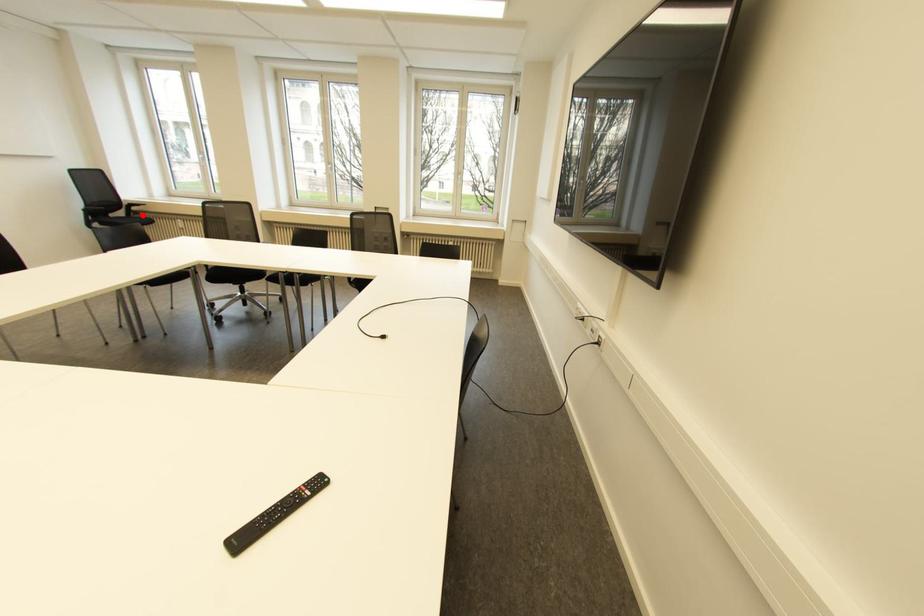
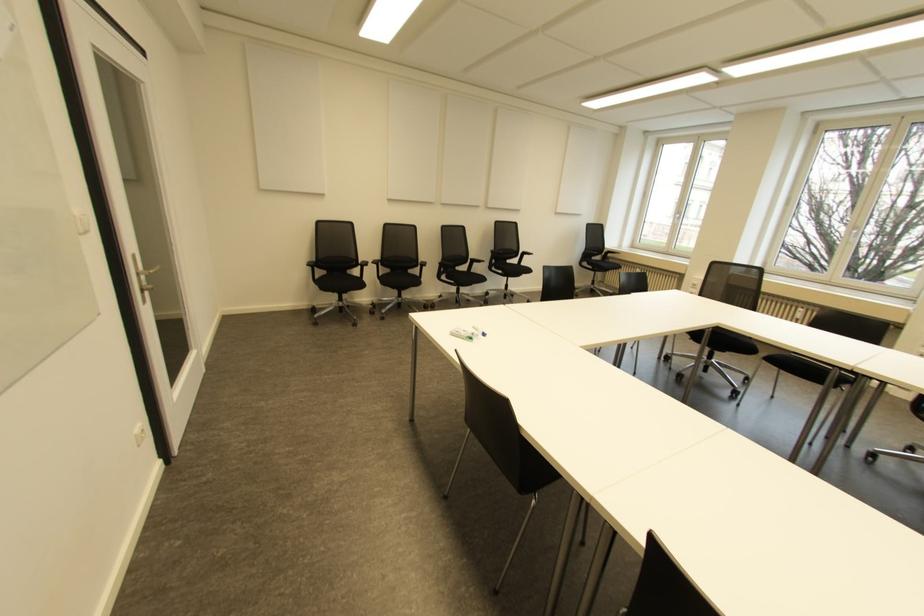
Question: I am providing you with two images of the same scene from different viewpoints. A red point is marked on the first image. Is the red point's position out of view in image 2?

Choices:
 (A) Yes
 (B) No

Answer: (B)